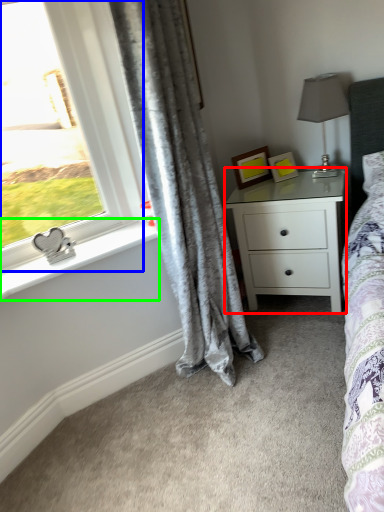
Question: Based on their relative distances, which object is farther from nightstand (highlighted by a red box)? Choose from window (highlighted by a blue box) and window sill (highlighted by a green box).

Choices:
 (A) window
 (B) window sill

Answer: (A)